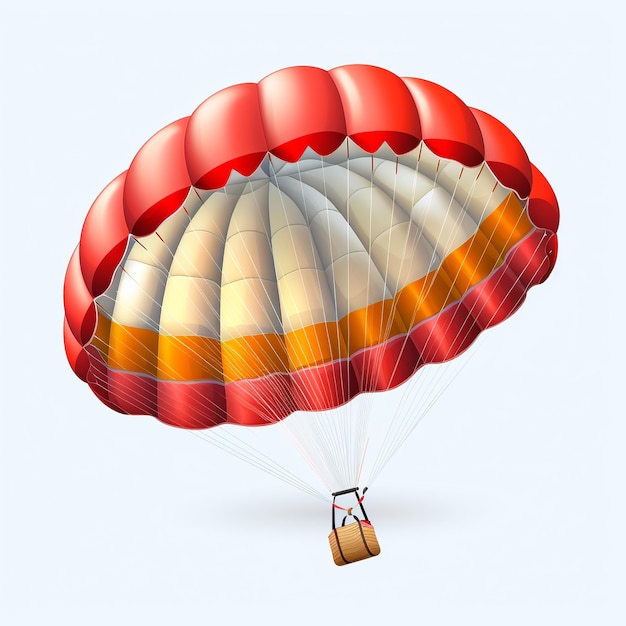
Identify the location of cable. Image resolution: width=626 pixels, height=626 pixels. (419, 394).